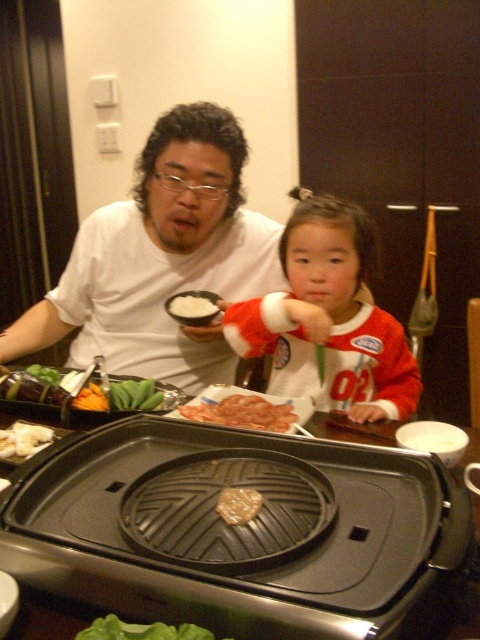
Question: Does santa claus sweater at center come in front of white matte rice at center?

Choices:
 (A) yes
 (B) no

Answer: (A)

Question: Is green leafy vegetable at lower left thinner than white fluffy rice at upper left?

Choices:
 (A) no
 (B) yes

Answer: (A)

Question: Does pink glossy raw meat at center appear on the right side of white fluffy rice at upper left?

Choices:
 (A) yes
 (B) no

Answer: (A)

Question: Which of the following is the farthest from the observer?

Choices:
 (A) (317, 310)
 (B) (206, 310)
 (C) (19, 426)

Answer: (B)

Question: Which point is closer to the camera taking this photo?

Choices:
 (A) (115, 408)
 (B) (213, 404)
 (C) (143, 388)

Answer: (A)

Question: Which point is closer to the camera taking this photo?

Choices:
 (A) (228, 490)
 (B) (201, 308)
 (C) (249, 417)

Answer: (A)